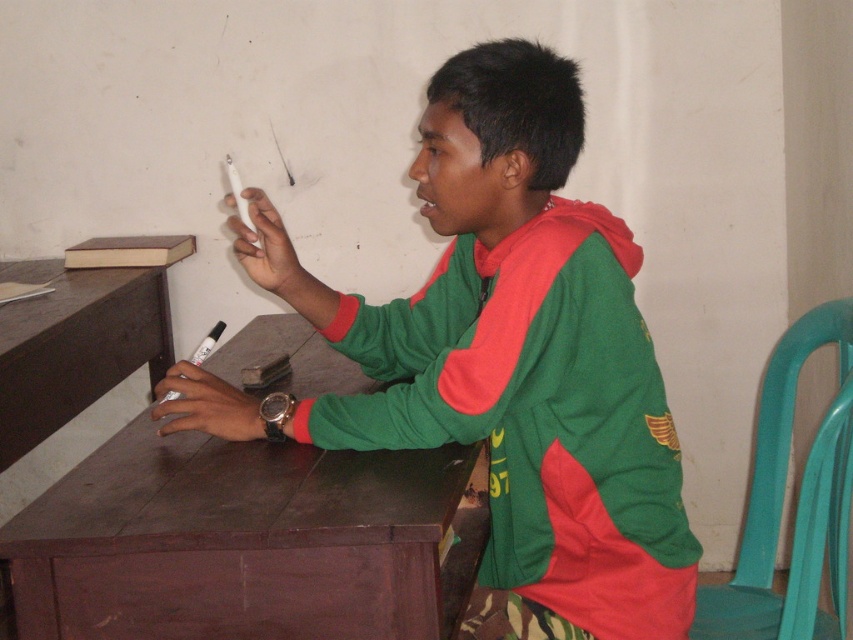
Consider the image. You are a delivery person who needs to place a package between the brown wood table at center and the brown wood table at left. The package is 24 inches long. Can you fit it between them?

The distance between the brown wood table at center and the brown wood table at left is 23.52 inches, which is slightly less than the package length of 24 inches. Therefore, the package cannot be placed between them.

You are a student who needs to place a 12 inch notebook on the desk. Given the distance between the green matte jacket at center and the brown wood table at left, will the notebook fit on the table without overlapping the jacket?

The green matte jacket at center is 37.64 inches from the brown wood table at left. Since the notebook is only 12 inches long, it can fit on the table without overlapping the jacket as there is sufficient space between them.

You are a student who wants to place a new notebook on the desk. Given the current arrangement, can you place the notebook on the brown wood table at center without moving the green matte jacket at center?

The green matte jacket at center is positioned over brown wood table at center, so placing the notebook would require moving the jacket first.